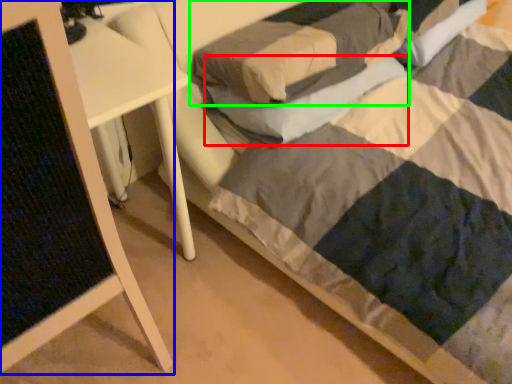
Question: Based on their relative distances, which object is nearer to pillow (highlighted by a red box)? Choose from furniture (highlighted by a blue box) and pillow (highlighted by a green box).

Choices:
 (A) furniture
 (B) pillow

Answer: (B)